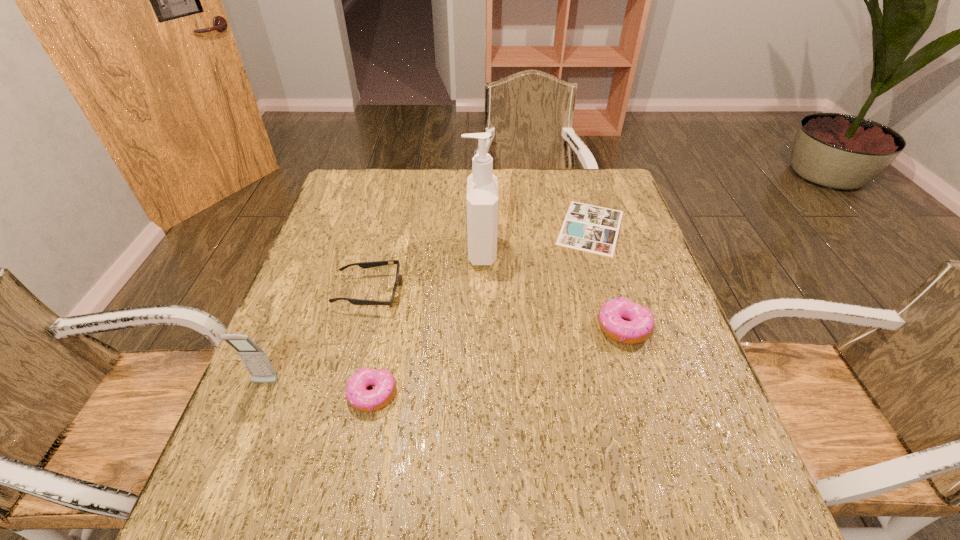
You are a GUI agent. You are given a task and a screenshot of the screen. Output one action in this format:
    pyautogui.click(x=<x>, y=<y>)
    Task: Click on the vacant area that lies between the shortest object and the tallest object
    This screenshot has height=540, width=960.
    Given the screenshot: What is the action you would take?
    pyautogui.click(x=536, y=239)

This screenshot has height=540, width=960. In order to click on free space between the shorter doughnut and the cleansing agent in this screenshot , I will do `click(426, 323)`.

The height and width of the screenshot is (540, 960). In order to click on free space between the shorter doughnut and the fourth object from left to right in this screenshot , I will do `click(426, 323)`.

Locate an element on the screen. vacant area between the tallest object and the left doughnut is located at coordinates (426, 323).

Find the location of `vacant area between the taller doughnut and the cleansing agent`. vacant area between the taller doughnut and the cleansing agent is located at coordinates (552, 289).

I want to click on free point between the cleansing agent and the sunglasses, so click(x=424, y=272).

Locate an element on the screen. Image resolution: width=960 pixels, height=540 pixels. free point between the sunglasses and the fourth shortest object is located at coordinates (496, 310).

Where is `free spot between the tallest object and the right doughnut`? This screenshot has width=960, height=540. free spot between the tallest object and the right doughnut is located at coordinates (552, 289).

Find the location of a particular element. free space between the second tallest object and the cleansing agent is located at coordinates (373, 317).

Locate an element on the screen. Image resolution: width=960 pixels, height=540 pixels. the fourth closest object to the sunglasses is located at coordinates (588, 228).